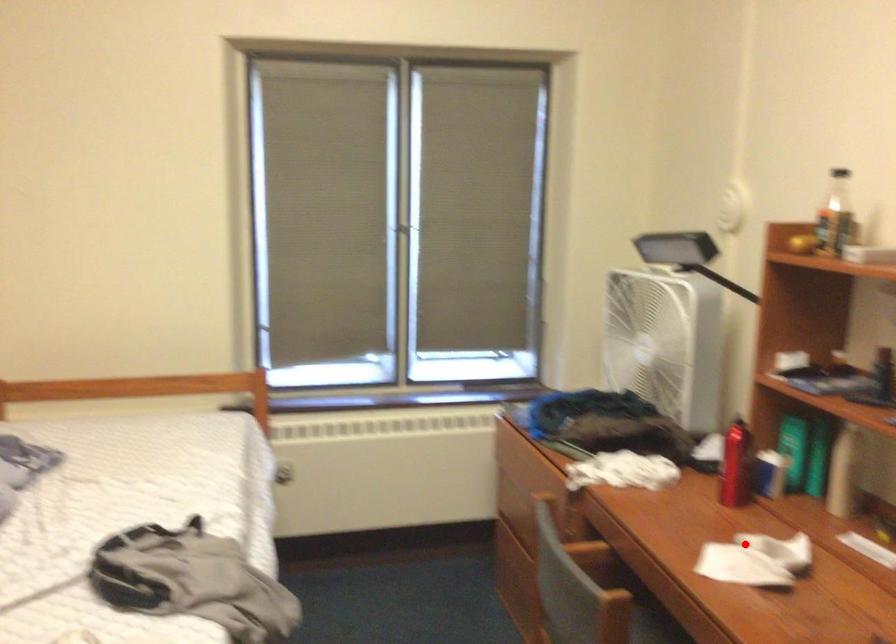
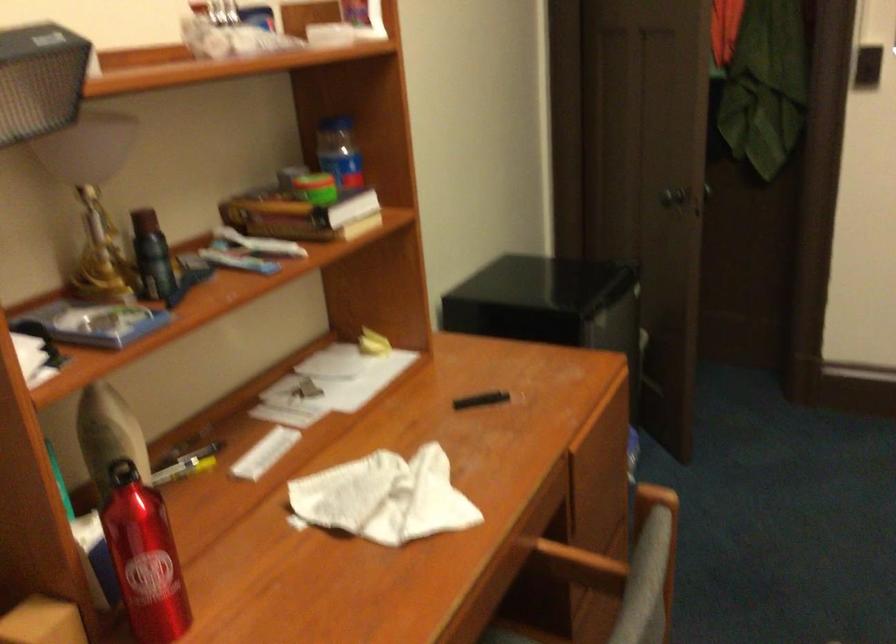
In the second image, find the point that corresponds to the highlighted location in the first image.

(383, 498)